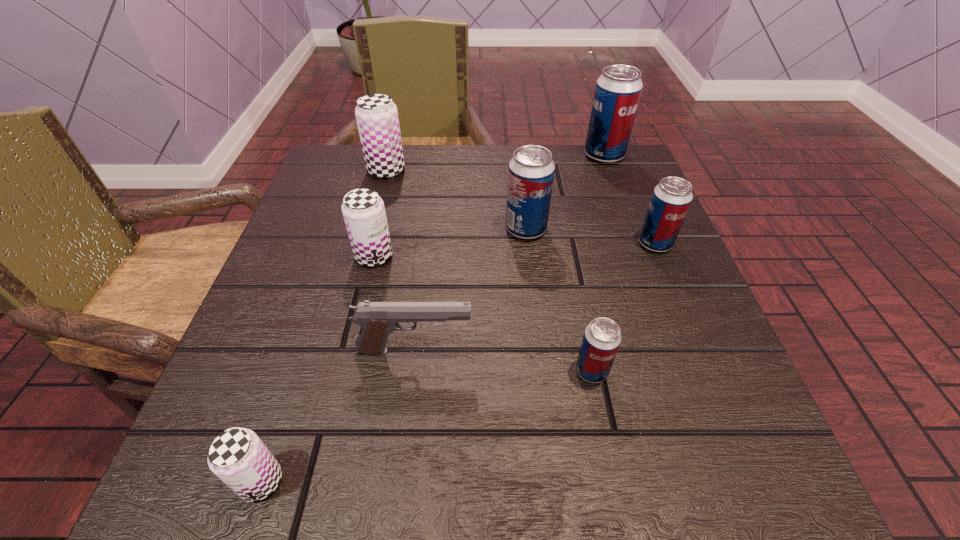
This screenshot has height=540, width=960. I want to click on object at the near edge, so click(x=237, y=456).

The height and width of the screenshot is (540, 960). I want to click on object located at the far left corner, so click(376, 114).

Locate an element on the screen. object that is at the near left corner is located at coordinates (237, 456).

Where is `object present at the far right corner`? Image resolution: width=960 pixels, height=540 pixels. object present at the far right corner is located at coordinates (618, 90).

The image size is (960, 540). In order to click on vacant space at the far edge of the desktop in this screenshot , I will do `click(483, 146)`.

At what (x,y) coordinates should I click in order to perform the action: click on vacant space at the near edge. Please return your answer as a coordinate pair (x, y). The height and width of the screenshot is (540, 960). Looking at the image, I should click on (324, 455).

You are a GUI agent. You are given a task and a screenshot of the screen. Output one action in this format:
    pyautogui.click(x=<x>, y=<y>)
    Task: Click on the vacant area at the left edge of the desktop
    
    Given the screenshot: What is the action you would take?
    pyautogui.click(x=257, y=307)

At what (x,y) coordinates should I click in order to perform the action: click on free region at the right edge of the desktop. Please return your answer as a coordinate pair (x, y). Looking at the image, I should click on (669, 307).

This screenshot has width=960, height=540. Identify the location of free region at the far left corner of the desktop. (387, 180).

Identify the location of free space at the far right corner of the desktop. This screenshot has width=960, height=540. tap(632, 169).